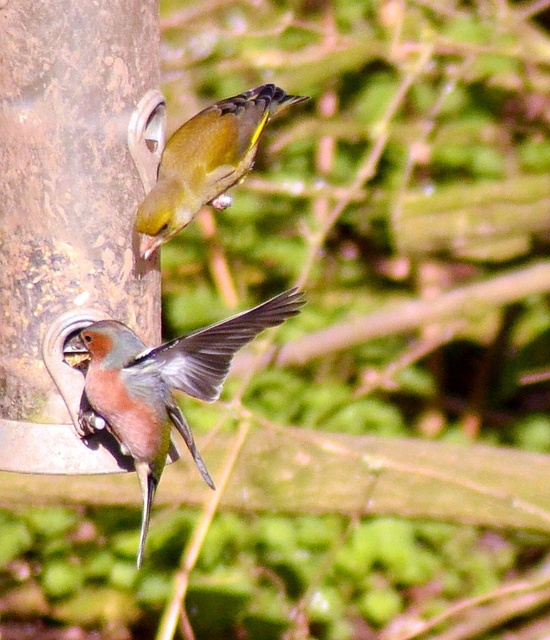
You are a birdwatcher trying to determine the relative sizes of objects in the scene. Based on the image, which object has a smaller width between the brown textured pole at left and the green glossy bird at upper center?

The brown textured pole at left has a smaller width compared to the green glossy bird at upper center.

You are a birdwatcher observing the brown speckled bird at lower left and the green glossy bird at upper center. Which bird is located to the right of the other?

The brown speckled bird at lower left is positioned on the right side of green glossy bird at upper center, so the brown speckled bird at lower left is to the right of the green glossy bird at upper center.